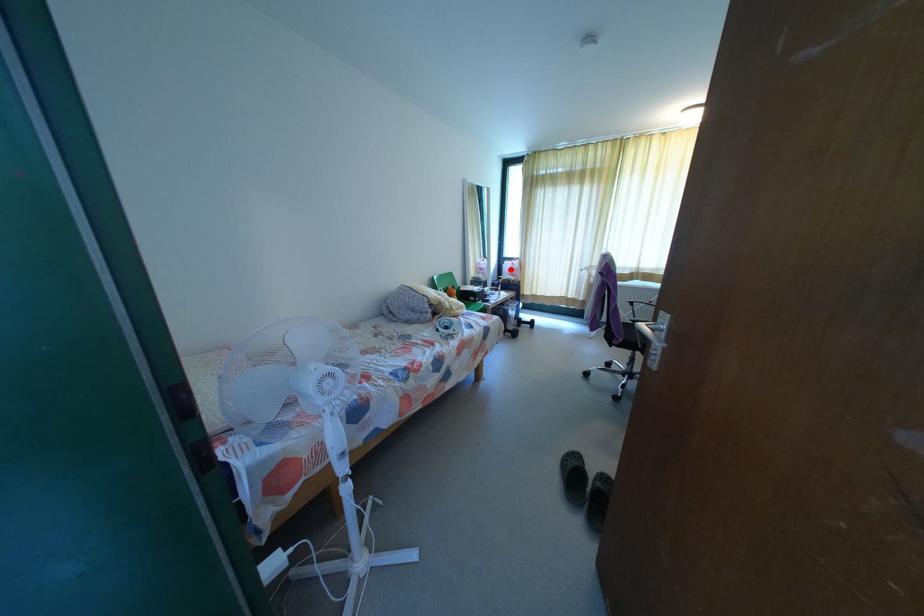
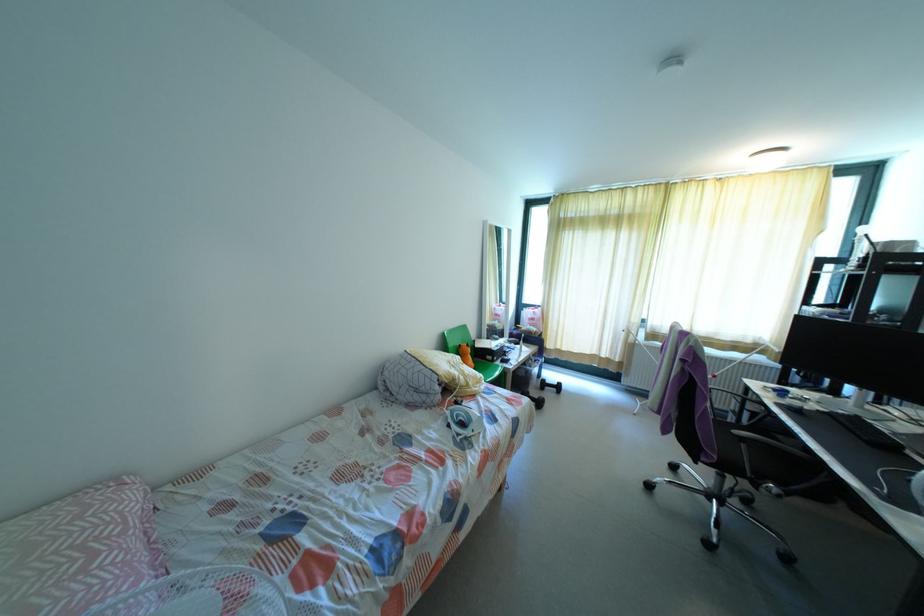
Find the pixel in the second image that matches the highlighted location in the first image.

(531, 318)